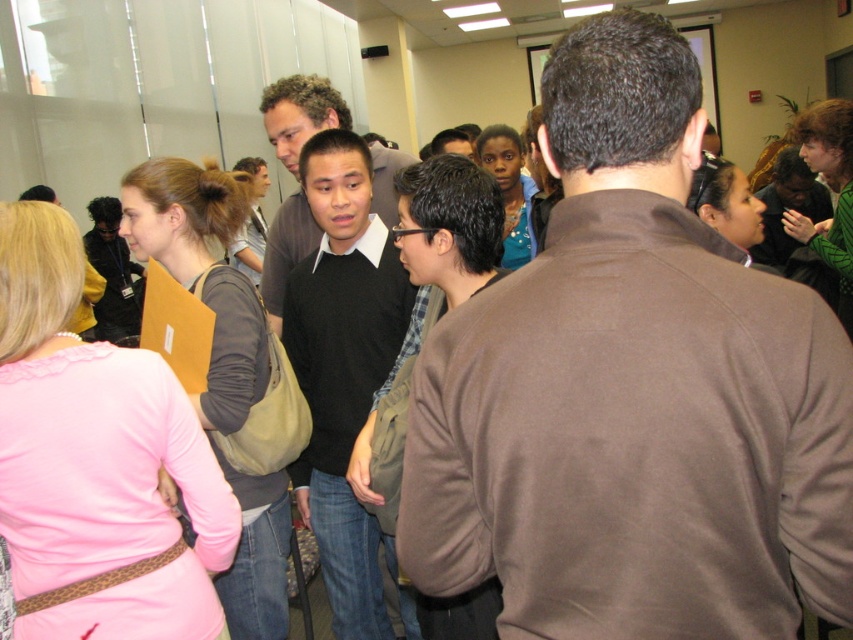
You are taking a photo of the conference room scene. You want to focus on the point at the bottom right corner of the frame. Which of the two points, point (659,364) or point (194,276), is closer to the camera and should be in focus?

Point (659,364) is closer to the camera than point (194,276), so it should be in focus.